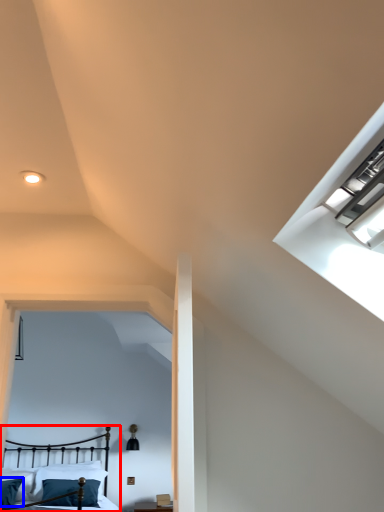
Question: Among these objects, which one is nearest to the camera, bed (highlighted by a red box) or pillow (highlighted by a blue box)?

Choices:
 (A) bed
 (B) pillow

Answer: (A)